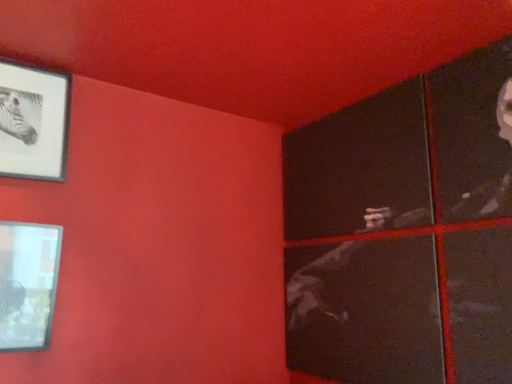
Question: Would you say matte black frame at upper left, the first picture frame positioned from the top, is to the left or to the right of matte glass picture frame at lower left, which is the second picture frame from top to bottom, in the picture?

Choices:
 (A) right
 (B) left

Answer: (B)

Question: In terms of width, does matte black frame at upper left, the second picture frame ordered from the bottom, look wider or thinner when compared to matte glass picture frame at lower left, which is the second picture frame from top to bottom?

Choices:
 (A) thin
 (B) wide

Answer: (A)

Question: Is matte black frame at upper left, the second picture frame ordered from the bottom, inside the boundaries of matte glass picture frame at lower left, which is the second picture frame from top to bottom, or outside?

Choices:
 (A) inside
 (B) outside

Answer: (B)

Question: Considering the positions of matte glass picture frame at lower left, which is the second picture frame from top to bottom, and matte black frame at upper left, the first picture frame positioned from the top, in the image, is matte glass picture frame at lower left, which is the second picture frame from top to bottom, bigger or smaller than matte black frame at upper left, the first picture frame positioned from the top,?

Choices:
 (A) big
 (B) small

Answer: (A)

Question: Does point (53, 279) appear closer or farther from the camera than point (18, 122)?

Choices:
 (A) farther
 (B) closer

Answer: (B)

Question: Considering the positions of matte glass picture frame at lower left, which is the second picture frame from top to bottom, and matte black frame at upper left, the first picture frame positioned from the top, in the image, is matte glass picture frame at lower left, which is the second picture frame from top to bottom, wider or thinner than matte black frame at upper left, the first picture frame positioned from the top,?

Choices:
 (A) thin
 (B) wide

Answer: (B)

Question: From the image's perspective, relative to matte black frame at upper left, the first picture frame positioned from the top, is matte glass picture frame at lower left, which is the second picture frame from top to bottom, above or below?

Choices:
 (A) below
 (B) above

Answer: (A)